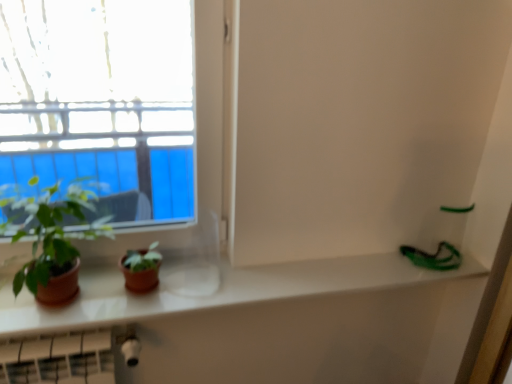
Question: From the image's perspective, is white glossy counter top at center above or below green matte plant at left?

Choices:
 (A) above
 (B) below

Answer: (B)

Question: Considering the positions of white glossy counter top at center and green matte plant at left in the image, is white glossy counter top at center taller or shorter than green matte plant at left?

Choices:
 (A) short
 (B) tall

Answer: (A)

Question: From a real-world perspective, is white glossy counter top at center positioned above or below green matte plant at left?

Choices:
 (A) above
 (B) below

Answer: (B)

Question: Is green matte plant at left taller or shorter than white glossy counter top at center?

Choices:
 (A) short
 (B) tall

Answer: (B)

Question: Is green matte plant at left in front of or behind white glossy counter top at center in the image?

Choices:
 (A) behind
 (B) front

Answer: (B)

Question: Based on their sizes in the image, would you say green matte plant at left is bigger or smaller than white glossy counter top at center?

Choices:
 (A) small
 (B) big

Answer: (B)

Question: From a real-world perspective, is green matte plant at left positioned above or below white glossy counter top at center?

Choices:
 (A) above
 (B) below

Answer: (A)